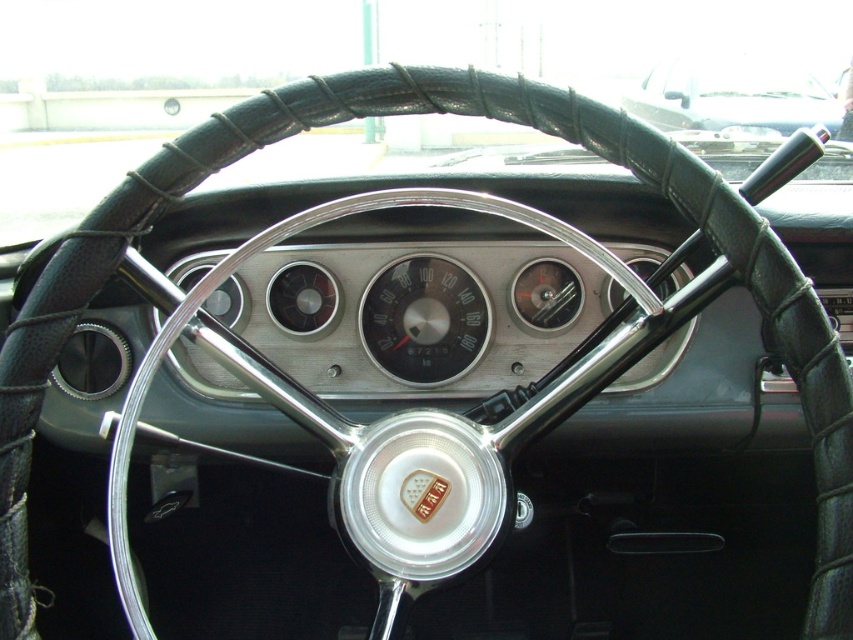
The image size is (853, 640). Describe the element at coordinates (733, 96) in the screenshot. I see `black leather steering wheel at upper center` at that location.

In the scene shown: Measure the distance between black leather steering wheel at upper center and matte silver gauge at center.

4.72 meters

This screenshot has width=853, height=640. In order to click on black leather steering wheel at upper center in this screenshot , I will do `click(733, 96)`.